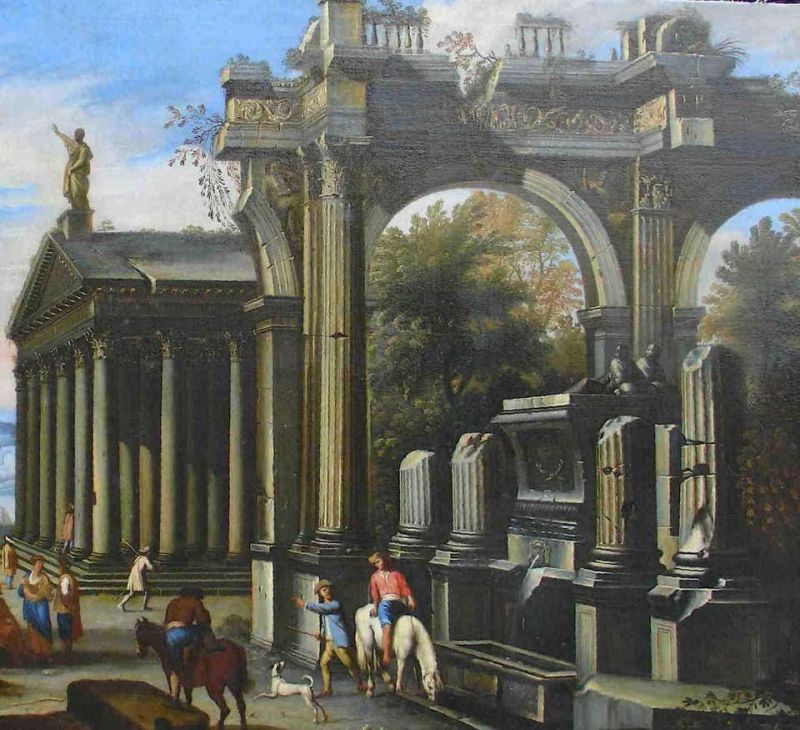
Locate an element on the screen. This screenshot has height=730, width=800. statue is located at coordinates (80, 169), (626, 366), (649, 365).